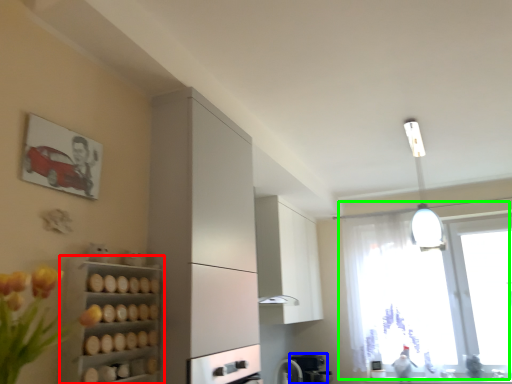
Question: Which object is positioned closest to shelf (highlighted by a red box)? Select from coffee machine (highlighted by a blue box) and window (highlighted by a green box).

Choices:
 (A) coffee machine
 (B) window

Answer: (A)